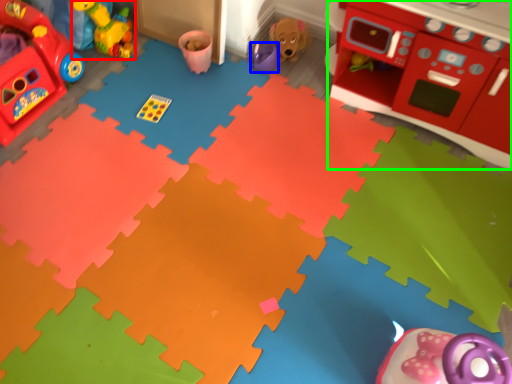
Question: Which is nearer to the toy (highlighted by a red box)? toy (highlighted by a blue box) or appliance (highlighted by a green box).

Choices:
 (A) toy
 (B) appliance

Answer: (A)